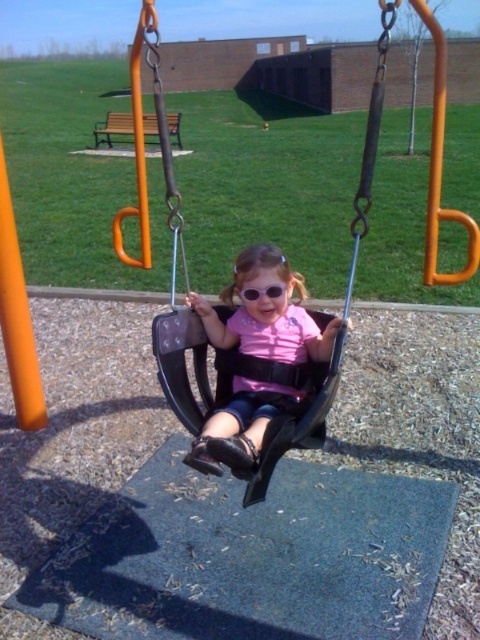
Question: Estimate the real-world distances between objects in this image. Which object is closer to the matte black swing at center?

Choices:
 (A) black plastic swing at center
 (B) transparent plastic goggles at center

Answer: (B)

Question: Is black plastic swing at center below matte black swing at center?

Choices:
 (A) yes
 (B) no

Answer: (B)

Question: Observing the image, what is the correct spatial positioning of black plastic swing at center in reference to transparent plastic goggles at center?

Choices:
 (A) above
 (B) below

Answer: (A)

Question: Which of these objects is positioned farthest from the black plastic swing at center?

Choices:
 (A) transparent plastic goggles at center
 (B) matte black swing at center

Answer: (A)

Question: Which object appears closest to the camera in this image?

Choices:
 (A) transparent plastic goggles at center
 (B) black plastic swing at center

Answer: (B)

Question: Does matte black swing at center have a greater width compared to transparent plastic goggles at center?

Choices:
 (A) no
 (B) yes

Answer: (B)